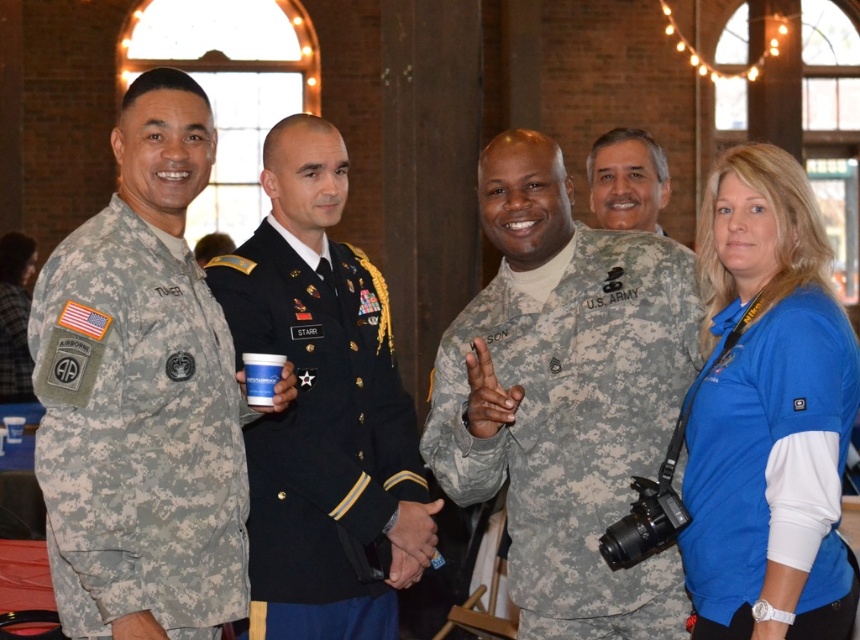
Question: Which point is closer to the camera taking this photo?

Choices:
 (A) (459, 326)
 (B) (777, 268)
 (C) (123, 492)
 (D) (332, 454)

Answer: (C)

Question: Can you confirm if blue polyester shirt at upper right is positioned to the left of black silk uniform at center?

Choices:
 (A) yes
 (B) no

Answer: (B)

Question: From the image, what is the correct spatial relationship of blue polyester shirt at upper right in relation to black silk uniform at center?

Choices:
 (A) above
 (B) below

Answer: (A)

Question: Among these objects, which one is farthest from the camera?

Choices:
 (A) black silk uniform at center
 (B) blue polyester shirt at upper right
 (C) camouflage uniform at center
 (D) camouflage fabric us army uniform at center

Answer: (C)

Question: Which point appears farthest from the camera in this image?

Choices:
 (A) (776, 371)
 (B) (127, 252)

Answer: (B)

Question: Is camouflage fabric uniform at left positioned before camouflage fabric us army uniform at center?

Choices:
 (A) no
 (B) yes

Answer: (B)